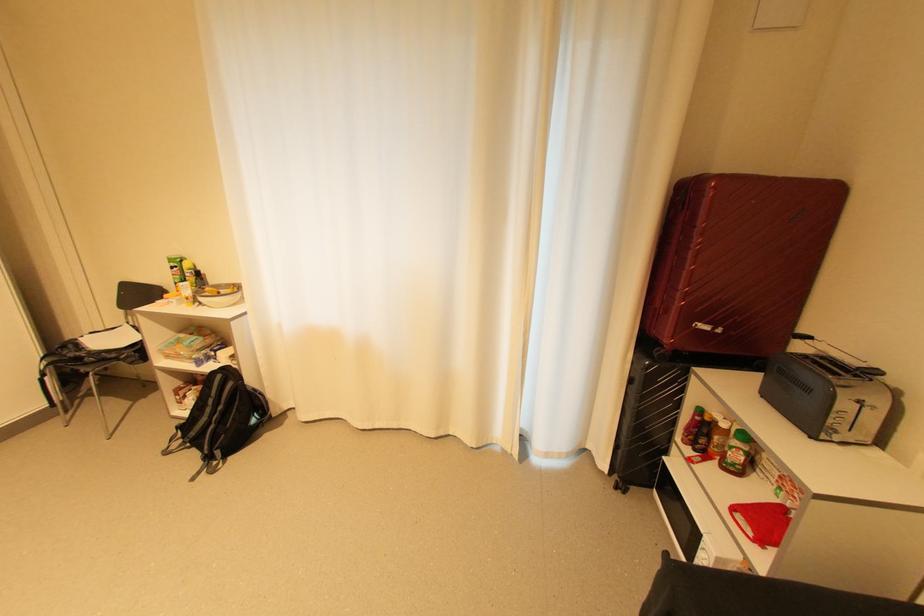
Which object does [737,261] point to?

It refers to a red suitcase.